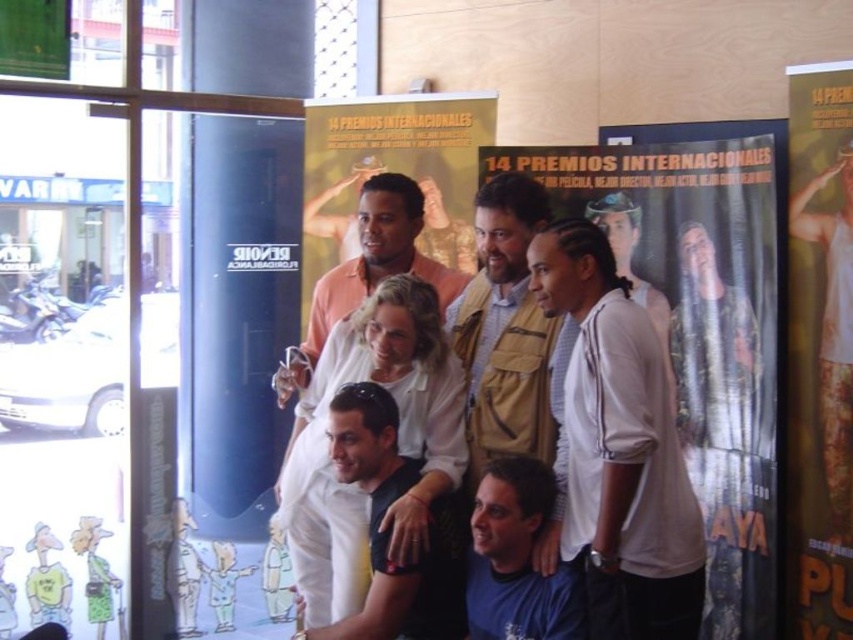
Question: Is beige textured vest at center wider than matte peach shirt at center?

Choices:
 (A) yes
 (B) no

Answer: (B)

Question: Estimate the real-world distances between objects in this image. Which object is farther from the white cotton shirt at upper right?

Choices:
 (A) matte peach shirt at center
 (B) white fabric poster at right
 (C) beige textured vest at center
 (D) blue fabric shirt at center

Answer: (A)

Question: Which object is closer to the camera taking this photo?

Choices:
 (A) blue fabric shirt at center
 (B) matte peach shirt at center
 (C) white matte shirt at center

Answer: (A)

Question: Among these points, which one is nearest to the camera?

Choices:
 (A) (469, 605)
 (B) (459, 632)
 (C) (660, 435)
 (D) (546, 216)

Answer: (C)

Question: Does white matte shirt at center appear on the left side of blue fabric shirt at center?

Choices:
 (A) yes
 (B) no

Answer: (A)

Question: Does beige textured vest at center have a larger size compared to matte peach shirt at center?

Choices:
 (A) no
 (B) yes

Answer: (B)